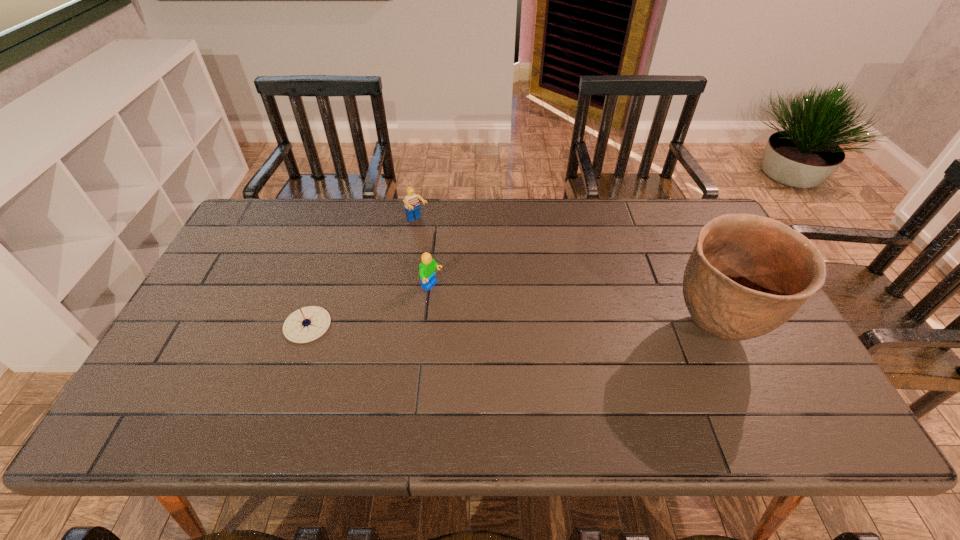
Find the location of a particular element. The width and height of the screenshot is (960, 540). object that stands as the third closest to the farthest object is located at coordinates (747, 275).

Where is `the third closest object to the farther Lego`? This screenshot has height=540, width=960. the third closest object to the farther Lego is located at coordinates 747,275.

Find the location of `vacant area in the image that satisfies the following two spatial constraints: 1. on the front side of the pottery; 2. on the left side of the farthest object`. vacant area in the image that satisfies the following two spatial constraints: 1. on the front side of the pottery; 2. on the left side of the farthest object is located at coordinates (x=401, y=328).

Where is `free location that satisfies the following two spatial constraints: 1. on the front side of the farthest object; 2. on the right side of the pottery`? The height and width of the screenshot is (540, 960). free location that satisfies the following two spatial constraints: 1. on the front side of the farthest object; 2. on the right side of the pottery is located at coordinates (401, 328).